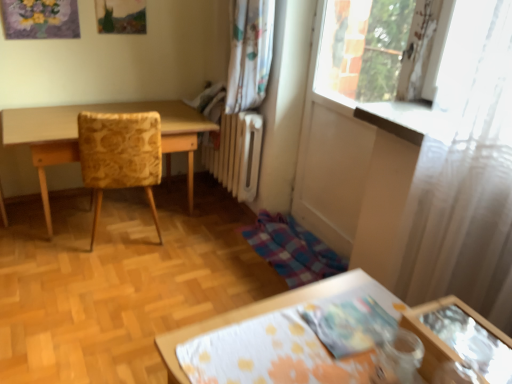
Identify the location of vacant area that lies between light wood table at left and yellow floral fabric chair at left. The width and height of the screenshot is (512, 384). (137, 239).